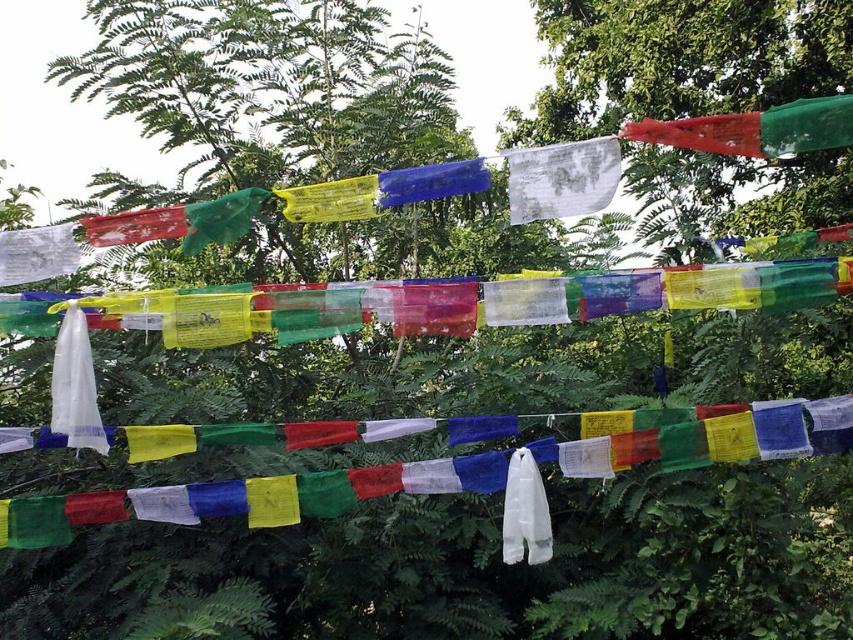
You are standing in front of the prayer flags and want to touch both the red translucent flag at upper right and the yellow translucent flag at center. Which flag should you reach for first to touch the one closer to you?

The red translucent flag at upper right is closer to the viewer than the yellow translucent flag at center, so you should reach for the red translucent flag at upper right first.

You are a photographer setting up a shot of the prayer flags. You notice the transparent plastic bag at lower left and the white sheer fabric at center in the frame. Which object would block more of the background foliage when positioned closer to the camera?

The transparent plastic bag at lower left is much taller than the white sheer fabric at center, so it would block more of the background foliage when positioned closer to the camera.

You are a bird flying between the red translucent flag at upper right and the yellow translucent flag at center. Can you fit through the space between them?

The distance between the red translucent flag at upper right and the yellow translucent flag at center is 64.76 centimeters. Since birds are typically smaller than this distance, you can comfortably fly through the space between them.